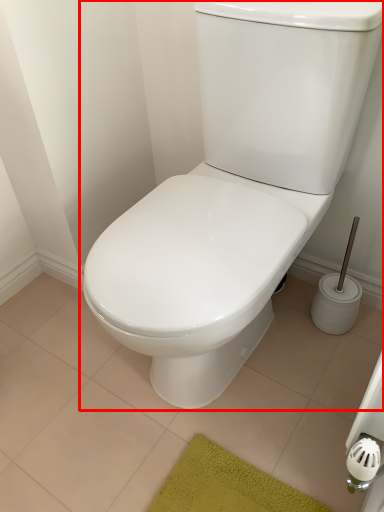
Question: Observing the image, what is the correct spatial positioning of toilet (annotated by the red box) in reference to tile?

Choices:
 (A) left
 (B) right

Answer: (B)